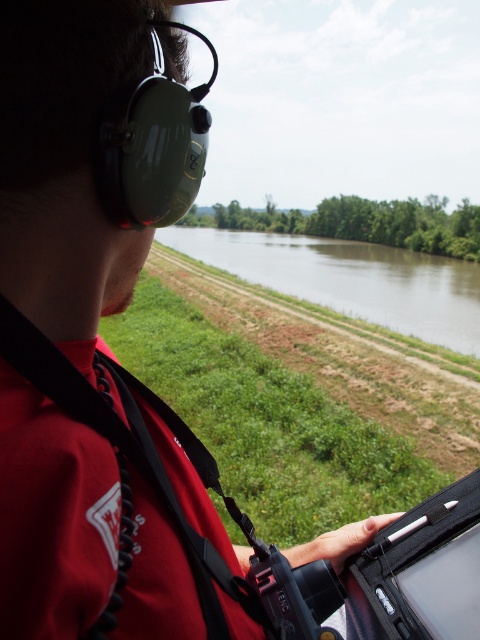
Question: Does red fabric life jacket at lower left have a lesser width compared to brown muddy water at center?

Choices:
 (A) yes
 (B) no

Answer: (A)

Question: Does red fabric life jacket at lower left have a smaller size compared to brown muddy water at center?

Choices:
 (A) yes
 (B) no

Answer: (A)

Question: Can you confirm if red fabric life jacket at lower left is bigger than brown muddy water at center?

Choices:
 (A) yes
 (B) no

Answer: (B)

Question: Which point is closer to the camera?

Choices:
 (A) (133, 451)
 (B) (444, 312)

Answer: (A)

Question: Among these points, which one is nearest to the camera?

Choices:
 (A) (109, 612)
 (B) (467, 344)

Answer: (A)